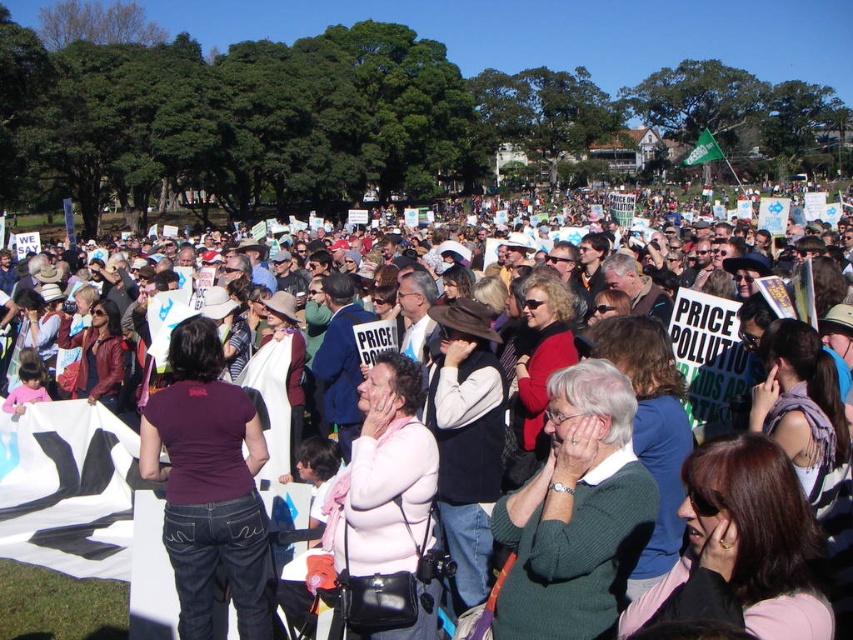
Is point (165, 557) positioned before point (544, 476)?

Yes, it is.

Can you confirm if pink fabric at center is wider than green sweater at center?

Correct, the width of pink fabric at center exceeds that of green sweater at center.

Does point (1, 436) lie in front of point (497, 502)?

No, it is behind (497, 502).

At what (x,y) coordinates should I click in order to perform the action: click on pink fabric at center. Please return your answer as a coordinate pair (x, y). The image size is (853, 640). Looking at the image, I should click on (68, 490).